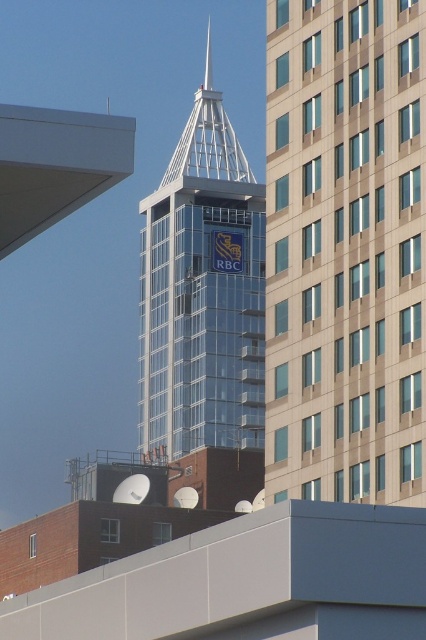
In the scene shown: Which is more to the right, beige glass building at center or clear glass tower at center?

From the viewer's perspective, beige glass building at center appears more on the right side.

Does beige glass building at center have a lesser width compared to clear glass tower at center?

Correct, beige glass building at center's width is less than clear glass tower at center's.

Image resolution: width=426 pixels, height=640 pixels. Find the location of `beige glass building at center`. beige glass building at center is located at coordinates (345, 250).